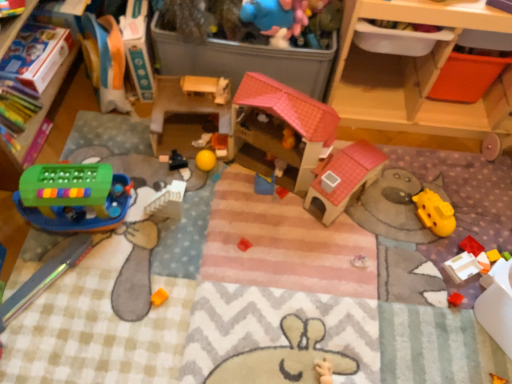
Locate an element on the screen. This screenshot has width=512, height=384. vacant area that lies between yellow rubber ball at center, the fifth toy in the right-to-left sequence, and yellow plastic spoon at center, the 7th toy when ordered from left to right is located at coordinates (232, 178).